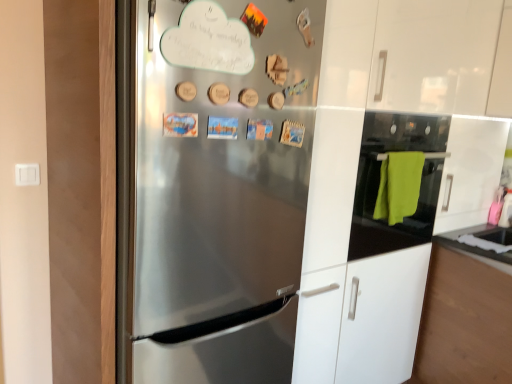
Question: Which is correct: stainless steel refrigerator at center is inside black glass oven at right, or outside of it?

Choices:
 (A) outside
 (B) inside

Answer: (A)

Question: Considering the positions of stainless steel refrigerator at center and black glass oven at right in the image, is stainless steel refrigerator at center bigger or smaller than black glass oven at right?

Choices:
 (A) big
 (B) small

Answer: (A)

Question: Considering the positions of point (134, 264) and point (353, 226), is point (134, 264) closer or farther from the camera than point (353, 226)?

Choices:
 (A) closer
 (B) farther

Answer: (A)

Question: Looking at the image, does black glass oven at right seem bigger or smaller compared to stainless steel refrigerator at center?

Choices:
 (A) small
 (B) big

Answer: (A)

Question: Looking at their shapes, would you say black glass oven at right is wider or thinner than stainless steel refrigerator at center?

Choices:
 (A) thin
 (B) wide

Answer: (A)

Question: In terms of height, does black glass oven at right look taller or shorter compared to stainless steel refrigerator at center?

Choices:
 (A) tall
 (B) short

Answer: (B)

Question: From the image's perspective, is black glass oven at right above or below stainless steel refrigerator at center?

Choices:
 (A) below
 (B) above

Answer: (B)